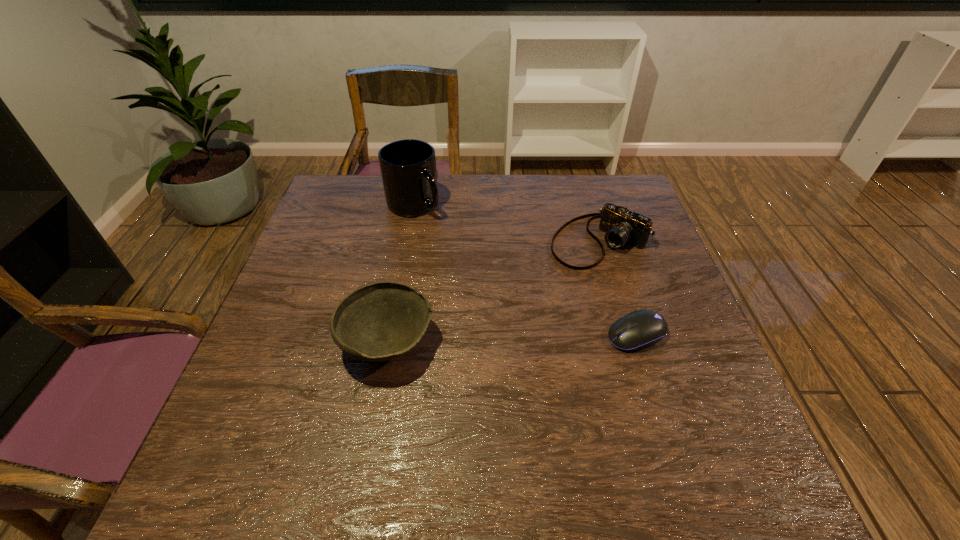
You are a GUI agent. You are given a task and a screenshot of the screen. Output one action in this format:
    pyautogui.click(x=<x>, y=<y>)
    Task: Click on the vacant space at the far left corner of the desktop
    The height and width of the screenshot is (540, 960).
    Given the screenshot: What is the action you would take?
    pyautogui.click(x=367, y=179)

Identify the location of vacant space at the far right corner of the desktop. 584,177.

Locate an element on the screen. This screenshot has width=960, height=540. blank region between the camera and the shortest object is located at coordinates (618, 288).

You are a GUI agent. You are given a task and a screenshot of the screen. Output one action in this format:
    pyautogui.click(x=<x>, y=<y>)
    Task: Click on the empty space that is in between the computer mouse and the second tallest object
    The image size is (960, 540).
    Given the screenshot: What is the action you would take?
    pyautogui.click(x=512, y=339)

Locate an element on the screen. This screenshot has height=540, width=960. free space between the bowl and the tallest object is located at coordinates 400,274.

Locate an element on the screen. The width and height of the screenshot is (960, 540). unoccupied area between the third tallest object and the shortest object is located at coordinates tap(618, 288).

This screenshot has width=960, height=540. What are the coordinates of `vacant space in between the mug and the camera` in the screenshot? It's located at (507, 223).

The image size is (960, 540). What are the coordinates of `free space between the camera and the bowl` in the screenshot? It's located at (494, 292).

In order to click on free area in between the mug and the computer mouse in this screenshot , I will do `click(525, 270)`.

Where is `free space that is in between the bowl and the shortest object`? Image resolution: width=960 pixels, height=540 pixels. free space that is in between the bowl and the shortest object is located at coordinates (512, 339).